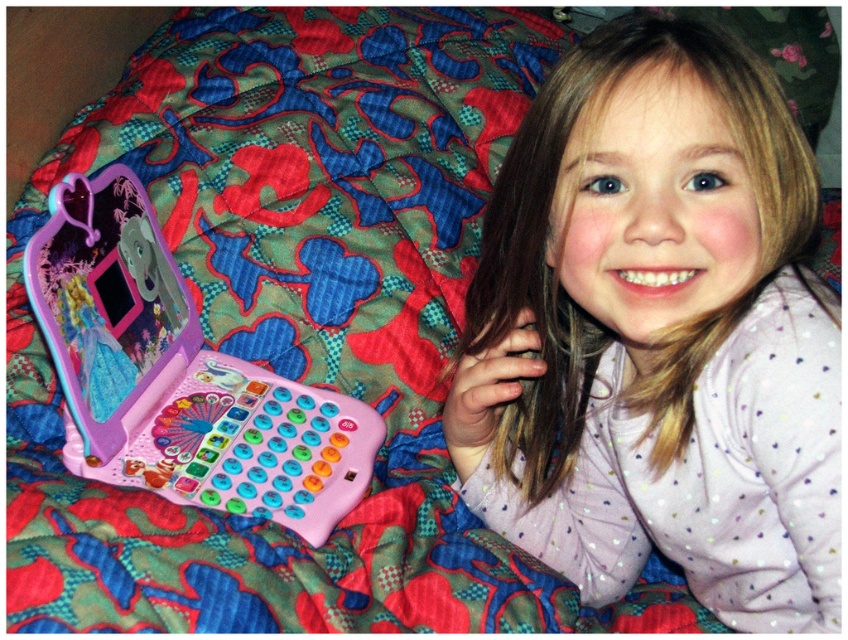
Can you confirm if pink fabric at upper right is bigger than pink plastic toy laptop at left?

Correct, pink fabric at upper right is larger in size than pink plastic toy laptop at left.

Does pink fabric at upper right lie in front of pink plastic toy laptop at left?

Yes.

Is point (798, 600) closer to camera compared to point (81, 212)?

Yes, it is.

The image size is (848, 640). I want to click on pink fabric at upper right, so click(657, 333).